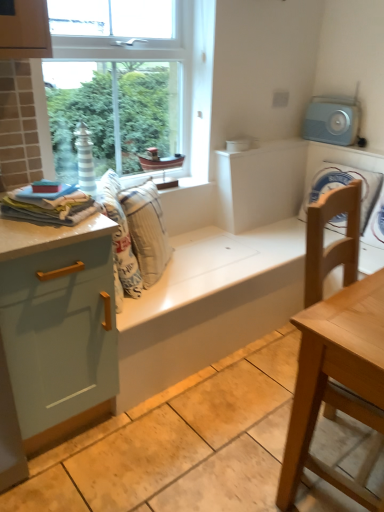
The image size is (384, 512). Describe the element at coordinates (146, 230) in the screenshot. I see `beige fabric cushion at center, which is the second material from left to right` at that location.

What do you see at coordinates (58, 325) in the screenshot? This screenshot has height=512, width=384. I see `light blue glossy cabinet at left` at bounding box center [58, 325].

Identify the location of soft cotton towels at left, arranged as the 1th material when viewed from the left. (50, 208).

Where is `beige fabric cushion at center, marked as the second material in a front-to-back arrangement`? beige fabric cushion at center, marked as the second material in a front-to-back arrangement is located at coordinates (146, 230).

Can we say white fabric washing machine at right lies outside white matte cabinet at center?

That's correct, white fabric washing machine at right is outside of white matte cabinet at center.

From the image's perspective, is white fabric washing machine at right below white matte cabinet at center?

Indeed, from the image's perspective, white fabric washing machine at right is shown beneath white matte cabinet at center.

Which of these two, white fabric washing machine at right or white matte cabinet at center, stands shorter?

white matte cabinet at center.

Does white fabric washing machine at right touch white matte cabinet at center?

They are not placed beside each other.

In the scene shown: From the image's perspective, which is above, light wood table at right or light blue plastic radio at upper right?

light blue plastic radio at upper right is shown above in the image.

Is light blue plastic radio at upper right at the back of light wood table at right?

No, light blue plastic radio at upper right is not at the back of light wood table at right.

Is light wood table at right surrounding light blue plastic radio at upper right?

Definitely not — light blue plastic radio at upper right is not inside light wood table at right.

Would you say light wood table at right is a long distance from light blue plastic radio at upper right?

Yes.

Does point (339, 117) lie in front of point (154, 237)?

That is False.

Looking at their sizes, would you say light blue plastic radio at upper right is wider or thinner than beige fabric cushion at center, which ranks as the 1th material in right-to-left order?

In the image, light blue plastic radio at upper right appears to be more narrow than beige fabric cushion at center, which ranks as the 1th material in right-to-left order.

From the picture: Which is correct: light blue plastic radio at upper right is inside beige fabric cushion at center, marked as the second material in a front-to-back arrangement, or outside of it?

light blue plastic radio at upper right exists outside the volume of beige fabric cushion at center, marked as the second material in a front-to-back arrangement.

Considering the positions of objects white fabric washing machine at right and light blue plastic radio at upper right in the image provided, who is more to the right, white fabric washing machine at right or light blue plastic radio at upper right?

white fabric washing machine at right.

Is white fabric washing machine at right positioned before light blue plastic radio at upper right?

That is True.

Would you say white fabric washing machine at right is a long distance from light blue plastic radio at upper right?

They are positioned close to each other.

From a real-world perspective, is white matte cabinet at center located higher than white fabric washing machine at right?

Yes, from a real-world perspective, white matte cabinet at center is over white fabric washing machine at right

Considering the relative positions of white matte cabinet at center and white fabric washing machine at right in the image provided, is white matte cabinet at center behind white fabric washing machine at right?

Yes, it is.

From the image's perspective, is white matte cabinet at center positioned above or below white fabric washing machine at right?

white matte cabinet at center is situated higher than white fabric washing machine at right in the image.

Considering the relative sizes of beige fabric cushion at center, which is the second material from left to right, and white matte cabinet at center in the image provided, is beige fabric cushion at center, which is the second material from left to right, bigger than white matte cabinet at center?

Yes, beige fabric cushion at center, which is the second material from left to right, is bigger than white matte cabinet at center.

Is beige fabric cushion at center, which is the second material from left to right, to the left of white matte cabinet at center from the viewer's perspective?

Yes, beige fabric cushion at center, which is the second material from left to right, is to the left of white matte cabinet at center.

Is beige fabric cushion at center, which is the first material in back-to-front order, next to white matte cabinet at center and touching it?

No, beige fabric cushion at center, which is the first material in back-to-front order, is not making contact with white matte cabinet at center.

From the image's perspective, is beige fabric cushion at center, which is the second material from left to right, located above or below white matte cabinet at center?

From the image's perspective, beige fabric cushion at center, which is the second material from left to right, appears below white matte cabinet at center.

Locate an element on the screen. The height and width of the screenshot is (512, 384). cabinetry above the light blue glossy cabinet at left (from the image's perspective) is located at coordinates (260, 184).

From a real-world perspective, which is physically below, light blue glossy cabinet at left or white matte cabinet at center?

light blue glossy cabinet at left, from a real-world perspective.

Which object is further away from the camera, light blue glossy cabinet at left or white matte cabinet at center?

white matte cabinet at center is more distant.

Is light blue glossy cabinet at left positioned with its back to white matte cabinet at center?

No, light blue glossy cabinet at left's orientation is not away from white matte cabinet at center.

The height and width of the screenshot is (512, 384). Identify the location of washing machine below the white matte cabinet at center (from the image's perspective). (339, 159).

Where is `appliance behind the light wood table at right`? This screenshot has width=384, height=512. appliance behind the light wood table at right is located at coordinates (332, 120).

From the picture: From the image, which object appears to be farther from beige fabric cushion at center, which is the second material from left to right, light blue glossy cabinet at left or soft cotton towels at left, the 1th material positioned from the front?

light blue glossy cabinet at left is positioned further to the anchor beige fabric cushion at center, which is the second material from left to right.

Looking at this image, looking at the image, which one is located further to white matte cabinet at center, white fabric washing machine at right or light blue glossy cabinet at left?

Among the two, light blue glossy cabinet at left is located further to white matte cabinet at center.

Looking at the image, which one is located closer to white matte cabinet at center, light wood table at right or white fabric washing machine at right?

Based on the image, white fabric washing machine at right appears to be nearer to white matte cabinet at center.

Considering their positions, is light blue glossy cabinet at left positioned further to light blue plastic radio at upper right than soft cotton towels at left, which is the second material from right to left?

Among the two, light blue glossy cabinet at left is located further to light blue plastic radio at upper right.

Looking at the image, which one is located further to soft cotton towels at left, which is the second material from right to left, light wood table at right or white matte cabinet at center?

Based on the image, white matte cabinet at center appears to be further to soft cotton towels at left, which is the second material from right to left.

Looking at the image, which one is located further to light blue plastic radio at upper right, light wood table at right or white matte cabinet at center?

Based on the image, light wood table at right appears to be further to light blue plastic radio at upper right.

Estimate the real-world distances between objects in this image. Which object is closer to soft cotton towels at left, the 1th material positioned from the front, light blue plastic radio at upper right or light blue glossy cabinet at left?

Based on the image, light blue glossy cabinet at left appears to be nearer to soft cotton towels at left, the 1th material positioned from the front.

Considering their positions, is light blue glossy cabinet at left positioned closer to beige fabric cushion at center, which ranks as the 1th material in right-to-left order, than white matte cabinet at center?

Among the two, light blue glossy cabinet at left is located nearer to beige fabric cushion at center, which ranks as the 1th material in right-to-left order.

Locate an element on the screen. cabinetry between light blue glossy cabinet at left and white fabric washing machine at right in the horizontal direction is located at coordinates (260, 184).

Locate an element on the screen. The width and height of the screenshot is (384, 512). material between soft cotton towels at left, which is the second material from right to left, and light blue plastic radio at upper right from left to right is located at coordinates (146, 230).

At what (x,y) coordinates should I click in order to perform the action: click on material between soft cotton towels at left, which is the second material from right to left, and white fabric washing machine at right. Please return your answer as a coordinate pair (x, y). The height and width of the screenshot is (512, 384). Looking at the image, I should click on (146, 230).

Where is `cabinetry between light wood table at right and light blue plastic radio at upper right from front to back`? cabinetry between light wood table at right and light blue plastic radio at upper right from front to back is located at coordinates (260, 184).